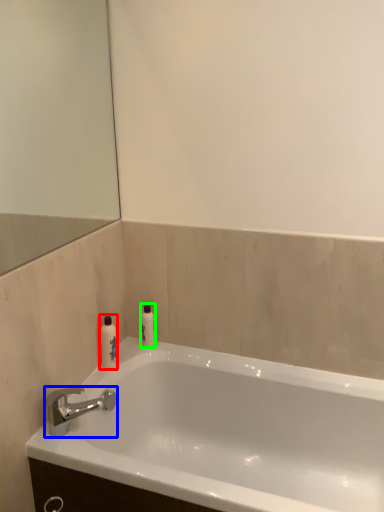
Question: Which is nearer to the toiletry (highlighted by a red box)? tap (highlighted by a blue box) or toiletry (highlighted by a green box).

Choices:
 (A) tap
 (B) toiletry

Answer: (B)